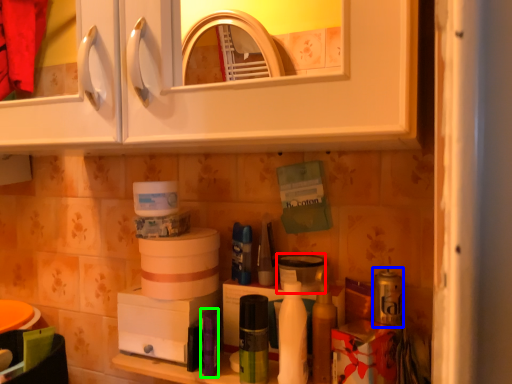
Question: Which object is the farthest from appliance (highlighted by a red box)? Choose among these: toiletry (highlighted by a blue box) or toiletry (highlighted by a green box).

Choices:
 (A) toiletry
 (B) toiletry

Answer: (B)